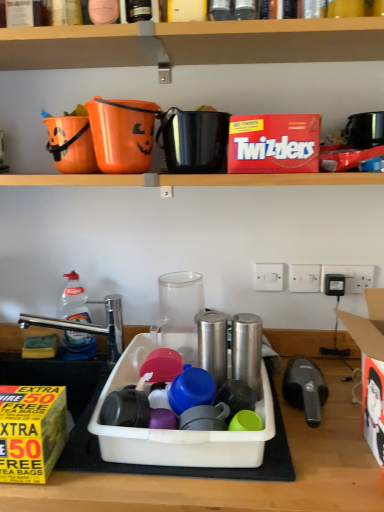
Question: From a real-world perspective, is wooden shelf at upper center on top of white plastic electric outlet at upper right, which ranks as the third electric outlet in left-to-right order?

Choices:
 (A) yes
 (B) no

Answer: (A)

Question: Is wooden shelf at upper center turned away from white plastic electric outlet at upper right, placed as the first electric outlet when sorted from right to left?

Choices:
 (A) no
 (B) yes

Answer: (A)

Question: Is wooden shelf at upper center at the right side of white plastic electric outlet at upper right, placed as the first electric outlet when sorted from right to left?

Choices:
 (A) no
 (B) yes

Answer: (A)

Question: Does wooden shelf at upper center lie behind white plastic electric outlet at upper right, placed as the first electric outlet when sorted from right to left?

Choices:
 (A) yes
 (B) no

Answer: (B)

Question: Is wooden shelf at upper center outside white plastic electric outlet at upper right, placed as the first electric outlet when sorted from right to left?

Choices:
 (A) no
 (B) yes

Answer: (B)

Question: Is silver metallic canister at center, which is counted as the first appliance, starting from the bottom, bigger or smaller than orange plastic bucket at upper center, the 2th appliance viewed from the top?

Choices:
 (A) small
 (B) big

Answer: (A)

Question: In terms of height, does silver metallic canister at center, the 4th appliance positioned from the left, look taller or shorter compared to orange plastic bucket at upper center, arranged as the 4th appliance when ordered from the bottom?

Choices:
 (A) short
 (B) tall

Answer: (B)

Question: Is silver metallic canister at center, the 4th appliance positioned from the left, in front of or behind orange plastic bucket at upper center, arranged as the 4th appliance when ordered from the bottom, in the image?

Choices:
 (A) front
 (B) behind

Answer: (A)

Question: Is point (238, 343) positioned closer to the camera than point (124, 117)?

Choices:
 (A) farther
 (B) closer

Answer: (B)

Question: From the image's perspective, is white plastic electric outlet at upper right, placed as the first electric outlet when sorted from right to left, positioned above or below white cardboard lunch box at right?

Choices:
 (A) below
 (B) above

Answer: (B)

Question: Is point (324, 269) closer or farther from the camera than point (380, 448)?

Choices:
 (A) farther
 (B) closer

Answer: (A)

Question: Considering the positions of white plastic electric outlet at upper right, placed as the first electric outlet when sorted from right to left, and white cardboard lunch box at right in the image, is white plastic electric outlet at upper right, placed as the first electric outlet when sorted from right to left, taller or shorter than white cardboard lunch box at right?

Choices:
 (A) tall
 (B) short

Answer: (B)

Question: Is white plastic electric outlet at upper right, which ranks as the third electric outlet in left-to-right order, wider or thinner than white cardboard lunch box at right?

Choices:
 (A) wide
 (B) thin

Answer: (B)

Question: Considering the positions of point (347, 20) and point (8, 429), is point (347, 20) closer or farther from the camera than point (8, 429)?

Choices:
 (A) farther
 (B) closer

Answer: (A)

Question: From a real-world perspective, is wooden shelf at upper center above or below yellow paper box at lower left, arranged as the 1th box when ordered from the bottom?

Choices:
 (A) above
 (B) below

Answer: (A)